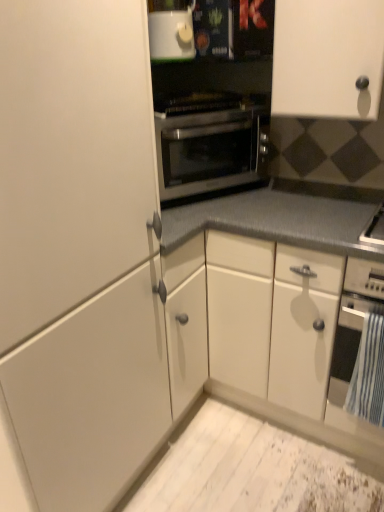
What is the approximate width of black matte oven at lower right, arranged as the second oven when viewed from the top?

The width of black matte oven at lower right, arranged as the second oven when viewed from the top, is 24.36 inches.

Measure the distance between point (x=183, y=30) and camera.

A distance of 1.45 meters exists between point (x=183, y=30) and camera.

What are the coordinates of `white matte cabinet at left, the 2th cabinetry positioned from the right` in the screenshot? It's located at pyautogui.click(x=80, y=248).

What do you see at coordinates (80, 248) in the screenshot?
I see `white matte cabinet at left, the 2th cabinetry positioned from the right` at bounding box center [80, 248].

At what (x,y) coordinates should I click in order to perform the action: click on white matte cabinet at upper right, which appears as the 2th cabinetry when viewed from the left. Please return your answer as a coordinate pair (x, y). Image resolution: width=384 pixels, height=512 pixels. Looking at the image, I should click on (328, 58).

What do you see at coordinates (328, 58) in the screenshot? The height and width of the screenshot is (512, 384). I see `white matte cabinet at upper right, which appears as the 2th cabinetry when viewed from the left` at bounding box center [328, 58].

What are the coordinates of `black matte oven at lower right, arranged as the first oven when viewed from the right` in the screenshot? It's located at (359, 354).

At what (x,y) coordinates should I click in order to perform the action: click on oven behind the black matte oven at lower right, the second oven positioned from the left. Please return your answer as a coordinate pair (x, y). Image resolution: width=384 pixels, height=512 pixels. Looking at the image, I should click on [x=209, y=142].

In the scene shown: From a real-world perspective, is black matte oven at lower right, the second oven positioned from the left, physically located above or below stainless steel oven at center, positioned as the first oven in left-to-right order?

A: From a real-world perspective, black matte oven at lower right, the second oven positioned from the left, is physically below stainless steel oven at center, positioned as the first oven in left-to-right order.

Does black matte oven at lower right, arranged as the 1th oven when ordered from the bottom, appear on the right side of stainless steel oven at center, which appears as the second oven when viewed from the right?

Indeed, black matte oven at lower right, arranged as the 1th oven when ordered from the bottom, is positioned on the right side of stainless steel oven at center, which appears as the second oven when viewed from the right.

Between black matte oven at lower right, the second oven positioned from the left, and stainless steel oven at center, marked as the 2th oven in a bottom-to-top arrangement, which one has smaller width?

stainless steel oven at center, marked as the 2th oven in a bottom-to-top arrangement, is thinner.

How many degrees apart are the facing directions of white glossy microwave at upper center and stainless steel oven at center, marked as the 2th oven in a bottom-to-top arrangement?

The facing directions of white glossy microwave at upper center and stainless steel oven at center, marked as the 2th oven in a bottom-to-top arrangement, are 3.45 degrees apart.

The height and width of the screenshot is (512, 384). In the image, there is a stainless steel oven at center, which appears as the second oven when viewed from the right. Identify the location of appliance above it (from the image's perspective). (171, 29).

Is white glossy microwave at upper center completely or partially outside of stainless steel oven at center, which appears as the second oven when viewed from the right?

That's correct, white glossy microwave at upper center is outside of stainless steel oven at center, which appears as the second oven when viewed from the right.

Which of these two, white glossy microwave at upper center or stainless steel oven at center, which appears as the second oven when viewed from the right, is wider?

Wider between the two is stainless steel oven at center, which appears as the second oven when viewed from the right.

Is white matte cabinet at upper right, which appears as the 2th cabinetry when viewed from the left, in front of or behind white glossy microwave at upper center in the image?

In the image, white matte cabinet at upper right, which appears as the 2th cabinetry when viewed from the left, appears in front of white glossy microwave at upper center.

Which is farther, (x=380, y=13) or (x=170, y=14)?

The point (x=170, y=14) is behind.

Is white matte cabinet at upper right, which appears as the 2th cabinetry when viewed from the left, facing away from white glossy microwave at upper center?

That's not correct — white matte cabinet at upper right, which appears as the 2th cabinetry when viewed from the left, is not looking away from white glossy microwave at upper center.

Is white matte cabinet at upper right, which appears as the 2th cabinetry when viewed from the left, directly adjacent to white glossy microwave at upper center?

No, white matte cabinet at upper right, which appears as the 2th cabinetry when viewed from the left, is not beside white glossy microwave at upper center.

The height and width of the screenshot is (512, 384). Find the location of `appliance behind the black matte oven at lower right, arranged as the first oven when viewed from the right`. appliance behind the black matte oven at lower right, arranged as the first oven when viewed from the right is located at coordinates (171, 29).

Based on the photo, how distant is white glossy microwave at upper center from black matte oven at lower right, arranged as the 1th oven when ordered from the bottom?

They are 3.49 feet apart.

Which of these two, white glossy microwave at upper center or black matte oven at lower right, arranged as the first oven when viewed from the right, is wider?

With larger width is black matte oven at lower right, arranged as the first oven when viewed from the right.

Could black matte oven at lower right, arranged as the second oven when viewed from the top, be considered to be inside white glossy microwave at upper center?

No, white glossy microwave at upper center does not contain black matte oven at lower right, arranged as the second oven when viewed from the top.

The width and height of the screenshot is (384, 512). What are the coordinates of `the 2nd oven counting from the right side of the white matte cabinet at left, the 2th cabinetry positioned from the right` in the screenshot? It's located at (359, 354).

Which object is positioned more to the right, black matte oven at lower right, arranged as the second oven when viewed from the top, or white matte cabinet at left, the 2th cabinetry positioned from the right?

black matte oven at lower right, arranged as the second oven when viewed from the top, is more to the right.

Looking at their sizes, would you say black matte oven at lower right, arranged as the first oven when viewed from the right, is wider or thinner than white matte cabinet at left, the 2th cabinetry positioned from the right?

Clearly, black matte oven at lower right, arranged as the first oven when viewed from the right, has less width compared to white matte cabinet at left, the 2th cabinetry positioned from the right.

Who is smaller, black matte oven at lower right, the second oven positioned from the left, or white matte cabinet at left, the first cabinetry in the left-to-right sequence?

Smaller between the two is black matte oven at lower right, the second oven positioned from the left.

Is white matte cabinet at upper right, marked as the 1th cabinetry in a right-to-left arrangement, outside of black matte oven at lower right, the second oven positioned from the left?

white matte cabinet at upper right, marked as the 1th cabinetry in a right-to-left arrangement, is positioned outside black matte oven at lower right, the second oven positioned from the left.

Based on the photo, is white matte cabinet at upper right, which appears as the 2th cabinetry when viewed from the left, at the right side of black matte oven at lower right, arranged as the second oven when viewed from the top?

Incorrect, white matte cabinet at upper right, which appears as the 2th cabinetry when viewed from the left, is not on the right side of black matte oven at lower right, arranged as the second oven when viewed from the top.

In the scene shown: Could you tell me if white matte cabinet at upper right, which appears as the 2th cabinetry when viewed from the left, is facing black matte oven at lower right, arranged as the second oven when viewed from the top?

No.

How different are the orientations of black matte oven at lower right, arranged as the 1th oven when ordered from the bottom, and white glossy microwave at upper center in degrees?

The angular difference between black matte oven at lower right, arranged as the 1th oven when ordered from the bottom, and white glossy microwave at upper center is 60.8 degrees.

From the image's perspective, who appears lower, black matte oven at lower right, arranged as the first oven when viewed from the right, or white glossy microwave at upper center?

From the image's view, black matte oven at lower right, arranged as the first oven when viewed from the right, is below.

Looking at this image, between black matte oven at lower right, arranged as the first oven when viewed from the right, and white glossy microwave at upper center, which one has smaller width?

With smaller width is white glossy microwave at upper center.

How much distance is there between black matte oven at lower right, the second oven positioned from the left, and white glossy microwave at upper center?

black matte oven at lower right, the second oven positioned from the left, is 1.06 meters away from white glossy microwave at upper center.

The height and width of the screenshot is (512, 384). What are the coordinates of `oven that is below the stainless steel oven at center, the 1th oven viewed from the top (from the image's perspective)` in the screenshot? It's located at coord(359,354).

The image size is (384, 512). Identify the location of oven lying behind the white glossy microwave at upper center. (209, 142).

Estimate the real-world distances between objects in this image. Which object is further from stainless steel oven at center, positioned as the first oven in left-to-right order, white glossy microwave at upper center or black matte oven at lower right, arranged as the 1th oven when ordered from the bottom?

black matte oven at lower right, arranged as the 1th oven when ordered from the bottom, is further to stainless steel oven at center, positioned as the first oven in left-to-right order.

Estimate the real-world distances between objects in this image. Which object is further from white glossy microwave at upper center, white matte cabinet at upper right, which appears as the 2th cabinetry when viewed from the left, or stainless steel oven at center, positioned as the first oven in left-to-right order?

The object further to white glossy microwave at upper center is white matte cabinet at upper right, which appears as the 2th cabinetry when viewed from the left.

When comparing their distances from white matte cabinet at upper right, marked as the 1th cabinetry in a right-to-left arrangement, does stainless steel oven at center, which appears as the second oven when viewed from the right, or white matte cabinet at left, the first cabinetry in the left-to-right sequence, seem closer?

stainless steel oven at center, which appears as the second oven when viewed from the right, lies closer to white matte cabinet at upper right, marked as the 1th cabinetry in a right-to-left arrangement, than the other object.

From the image, which object appears to be farther from white matte cabinet at upper right, which appears as the 2th cabinetry when viewed from the left, white glossy microwave at upper center or white matte cabinet at left, the first cabinetry in the left-to-right sequence?

Among the two, white matte cabinet at left, the first cabinetry in the left-to-right sequence, is located further to white matte cabinet at upper right, which appears as the 2th cabinetry when viewed from the left.

When comparing their distances from stainless steel oven at center, which appears as the second oven when viewed from the right, does white matte cabinet at left, the first cabinetry in the left-to-right sequence, or white matte cabinet at upper right, which appears as the 2th cabinetry when viewed from the left, seem further?

Among the two, white matte cabinet at left, the first cabinetry in the left-to-right sequence, is located further to stainless steel oven at center, which appears as the second oven when viewed from the right.

Estimate the real-world distances between objects in this image. Which object is further from stainless steel oven at center, which appears as the second oven when viewed from the right, black matte oven at lower right, arranged as the 1th oven when ordered from the bottom, or white glossy microwave at upper center?

The object further to stainless steel oven at center, which appears as the second oven when viewed from the right, is black matte oven at lower right, arranged as the 1th oven when ordered from the bottom.

Estimate the real-world distances between objects in this image. Which object is further from white matte cabinet at left, the first cabinetry in the left-to-right sequence, stainless steel oven at center, which appears as the second oven when viewed from the right, or white matte cabinet at upper right, which appears as the 2th cabinetry when viewed from the left?

white matte cabinet at upper right, which appears as the 2th cabinetry when viewed from the left, is positioned further to the anchor white matte cabinet at left, the first cabinetry in the left-to-right sequence.

Looking at the image, which one is located further to white glossy microwave at upper center, black matte oven at lower right, the second oven positioned from the left, or stainless steel oven at center, marked as the 2th oven in a bottom-to-top arrangement?

black matte oven at lower right, the second oven positioned from the left, is further to white glossy microwave at upper center.

In order to click on oven between white glossy microwave at upper center and black matte oven at lower right, the second oven positioned from the left, vertically in this screenshot , I will do `click(209, 142)`.

Locate an element on the screen. The image size is (384, 512). cabinetry that lies between white glossy microwave at upper center and white matte cabinet at left, the first cabinetry in the left-to-right sequence, from top to bottom is located at coordinates (328, 58).

You are a GUI agent. You are given a task and a screenshot of the screen. Output one action in this format:
    pyautogui.click(x=<x>, y=<y>)
    Task: Click on the oven situated between white matte cabinet at left, the 2th cabinetry positioned from the right, and black matte oven at lower right, arranged as the first oven when viewed from the right, from left to right
    
    Given the screenshot: What is the action you would take?
    pyautogui.click(x=209, y=142)

Image resolution: width=384 pixels, height=512 pixels. What are the coordinates of `appliance situated between white matte cabinet at left, the 2th cabinetry positioned from the right, and black matte oven at lower right, arranged as the second oven when viewed from the top, from left to right` in the screenshot? It's located at (171, 29).